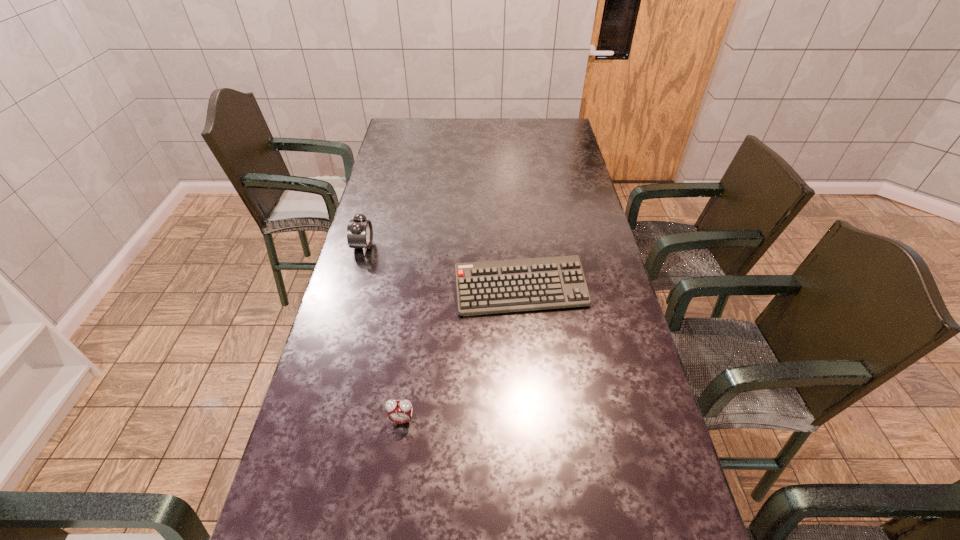
Identify the location of object at the right edge. (490, 287).

Where is `vacant area at the far edge`? vacant area at the far edge is located at coordinates (429, 137).

Locate an element on the screen. Image resolution: width=960 pixels, height=540 pixels. free space at the left edge of the desktop is located at coordinates (386, 169).

Identify the location of vacant area at the right edge of the desktop. The height and width of the screenshot is (540, 960). (633, 421).

Find the location of a particular element. This screenshot has width=960, height=540. empty location between the second tallest object and the left alarm clock is located at coordinates (382, 333).

I want to click on vacant area that lies between the computer keyboard and the left alarm clock, so click(442, 268).

I want to click on free spot between the taller alarm clock and the nearer alarm clock, so click(x=382, y=333).

I want to click on free space between the nearest object and the tallest object, so click(382, 333).

This screenshot has width=960, height=540. What are the coordinates of `free space between the computer keyboard and the left alarm clock` in the screenshot? It's located at (442, 268).

Identify the location of unoccupied area between the second farthest object and the nearer alarm clock. pos(461,355).